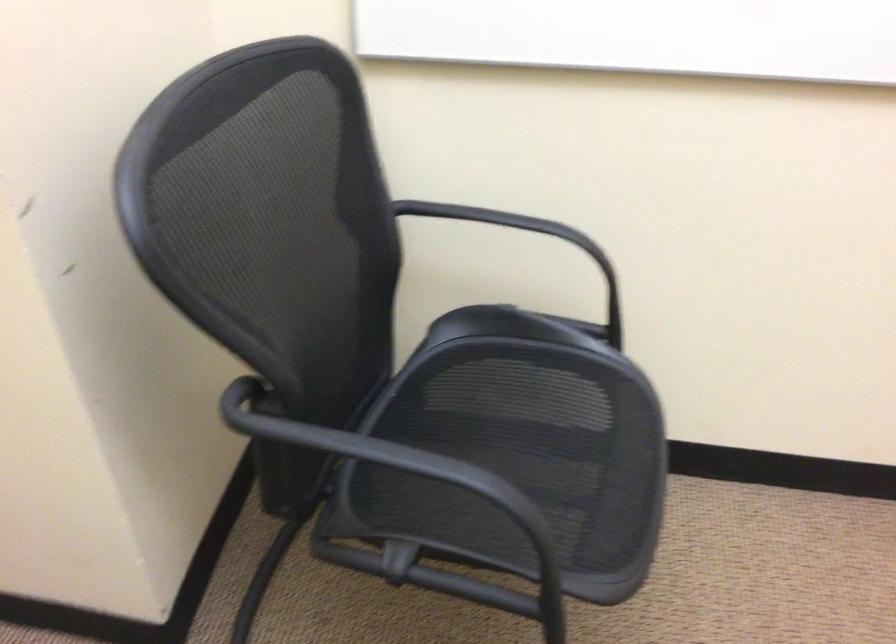
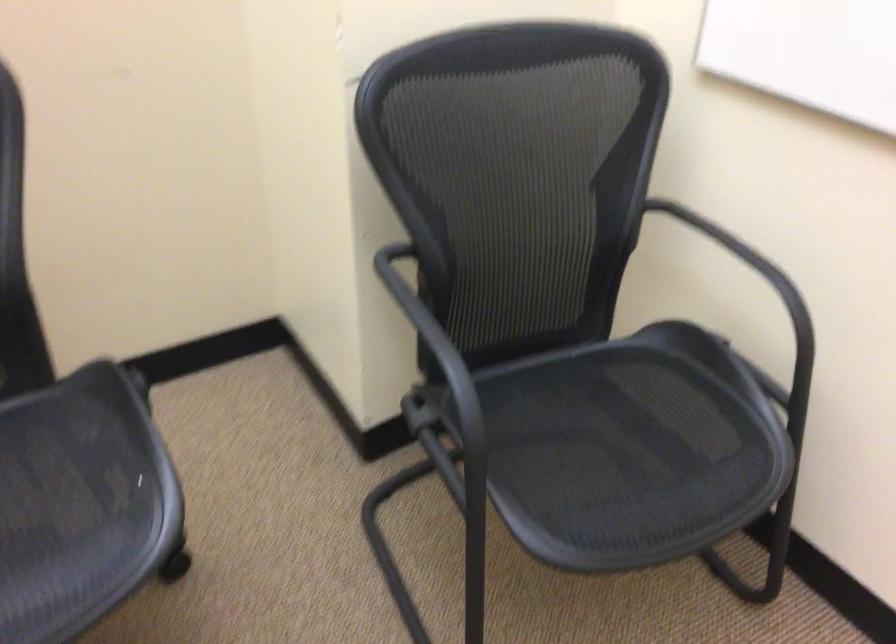
In the second image, find the point that corresponds to point 501,243 in the first image.

(756, 286)